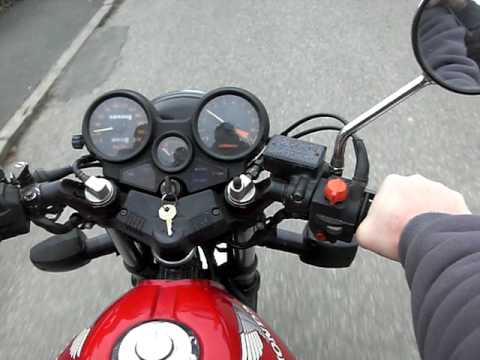
This screenshot has height=360, width=480. I want to click on cables, so click(61, 169), click(77, 171), click(290, 123), click(307, 129).